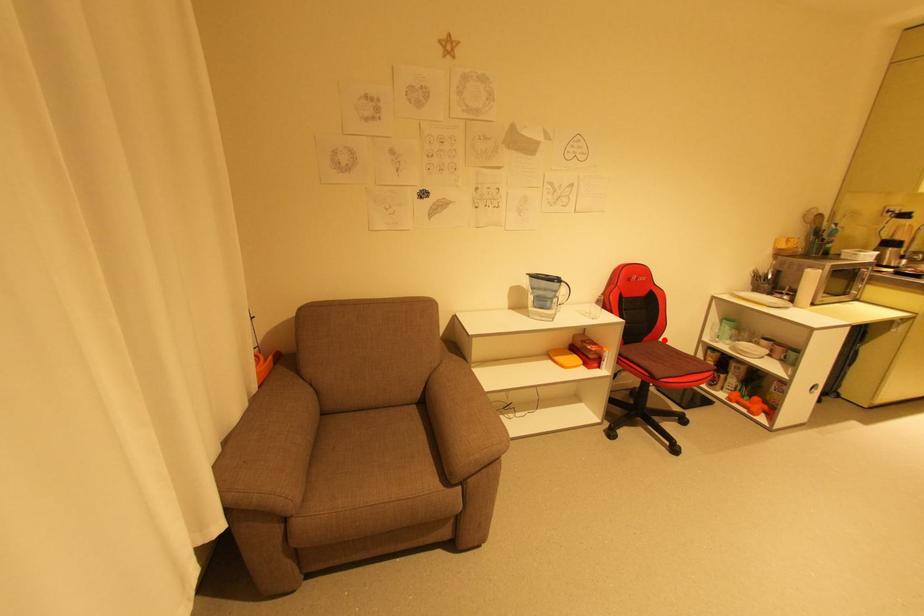
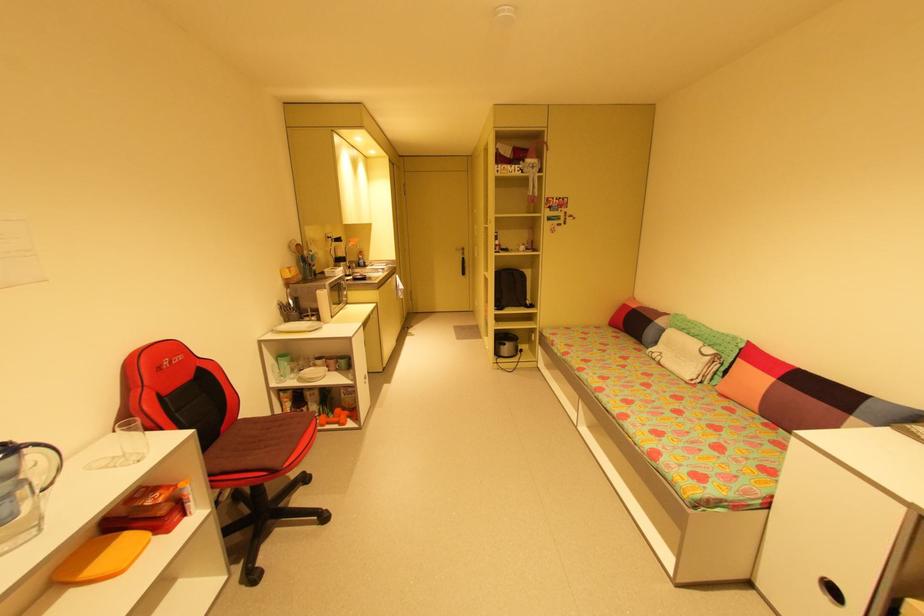
Locate, in the second image, the point that corresponds to the highlighted location in the first image.

(244, 418)